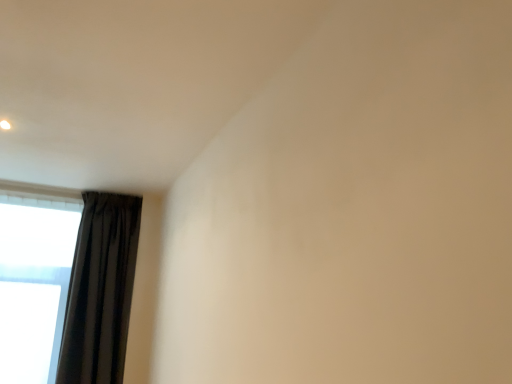
Where is `black velvet curtain at left`? This screenshot has width=512, height=384. black velvet curtain at left is located at coordinates (100, 290).

What do you see at coordinates (100, 290) in the screenshot? Image resolution: width=512 pixels, height=384 pixels. I see `black velvet curtain at left` at bounding box center [100, 290].

In order to click on black velvet curtain at left in this screenshot , I will do `click(100, 290)`.